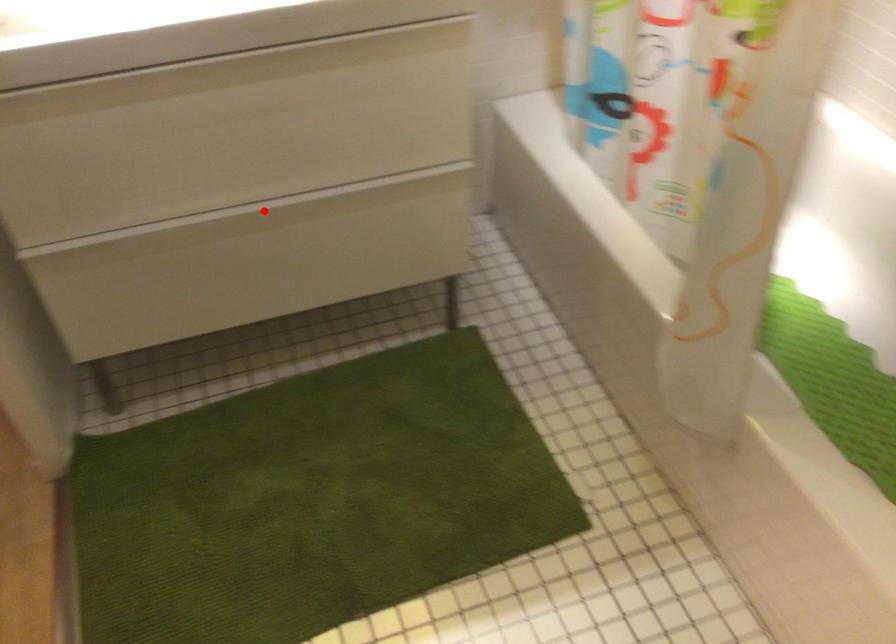
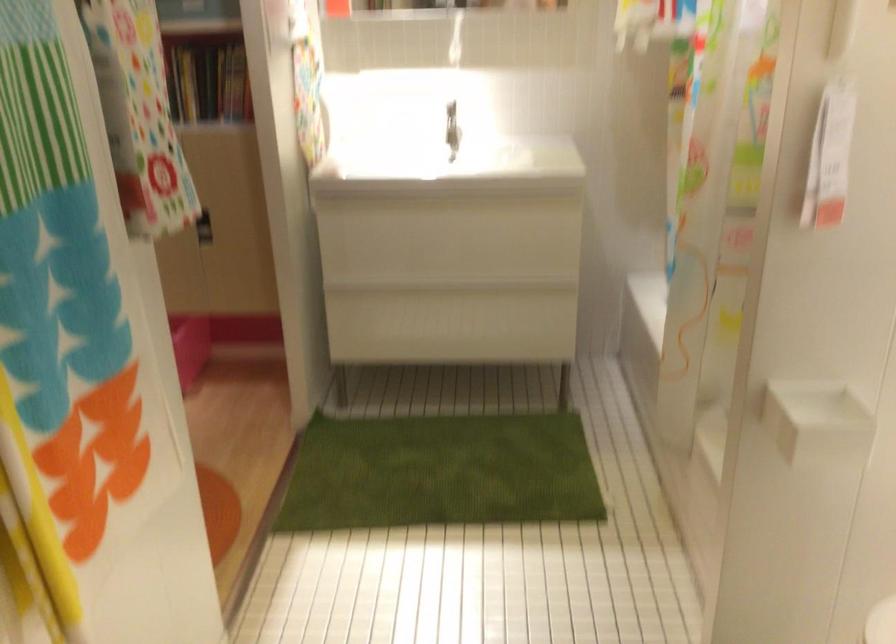
Question: I am providing you with two images of the same scene from different viewpoints. Image1 has a red point marked. In image2, the corresponding 3D location appears at what relative position? Reply with the corresponding letter.

Choices:
 (A) Closer
 (B) Farther

Answer: (B)